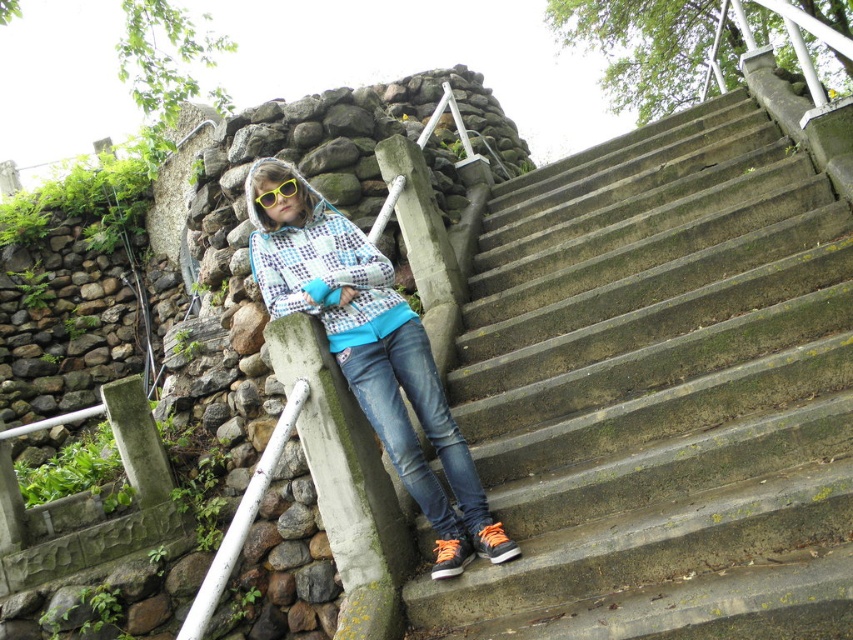
Does matte blue hoodie at center have a lesser width compared to denim jeans at lower center?

No, matte blue hoodie at center is not thinner than denim jeans at lower center.

Does matte blue hoodie at center appear over denim jeans at lower center?

Indeed, matte blue hoodie at center is positioned over denim jeans at lower center.

Which is behind, point (328, 280) or point (386, 352)?

Point (386, 352)

Where is `matte blue hoodie at center`? matte blue hoodie at center is located at coordinates (372, 353).

Is concrete stairs at center thinner than yellow plastic goggles at upper center?

Incorrect, concrete stairs at center's width is not less than yellow plastic goggles at upper center's.

Does concrete stairs at center have a smaller size compared to yellow plastic goggles at upper center?

No.

Is point (712, 216) in front of point (267, 202)?

No, it is behind (267, 202).

Where is `concrete stairs at center`? This screenshot has height=640, width=853. concrete stairs at center is located at coordinates (659, 392).

Is concrete stairs at center taller than matte blue hoodie at center?

No.

Does concrete stairs at center appear under matte blue hoodie at center?

Yes, concrete stairs at center is below matte blue hoodie at center.

Where is `concrete stairs at center`? Image resolution: width=853 pixels, height=640 pixels. concrete stairs at center is located at coordinates (659, 392).

Find the location of a particular element. Image resolution: width=853 pixels, height=640 pixels. concrete stairs at center is located at coordinates (659, 392).